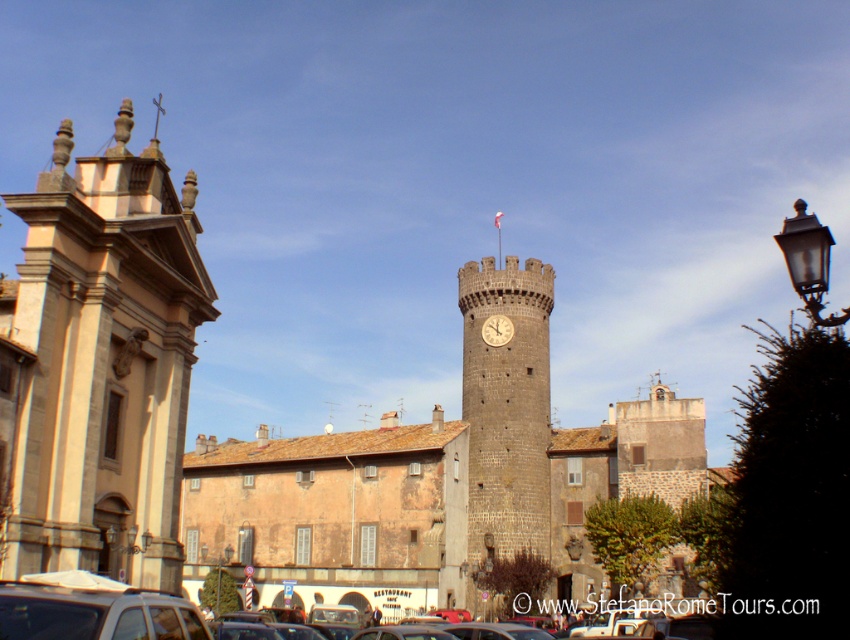
Question: Can you confirm if beige stone tower at left is positioned to the left of gold metallic clock at center?

Choices:
 (A) yes
 (B) no

Answer: (A)

Question: Is metallic silver car at center closer to camera compared to gold metallic clock at center?

Choices:
 (A) no
 (B) yes

Answer: (B)

Question: Is beige stone tower at left to the right of silver metallic car at lower left from the viewer's perspective?

Choices:
 (A) no
 (B) yes

Answer: (A)

Question: Which point is closer to the camera?

Choices:
 (A) (21, 636)
 (B) (469, 352)
 (C) (346, 627)

Answer: (A)

Question: Estimate the real-world distances between objects in this image. Which object is closer to the silver metallic car at lower left?

Choices:
 (A) metallic silver car at center
 (B) beige stone tower at left

Answer: (A)

Question: Which point is closer to the camera?

Choices:
 (A) (510, 412)
 (B) (134, 632)
 (C) (510, 321)

Answer: (B)